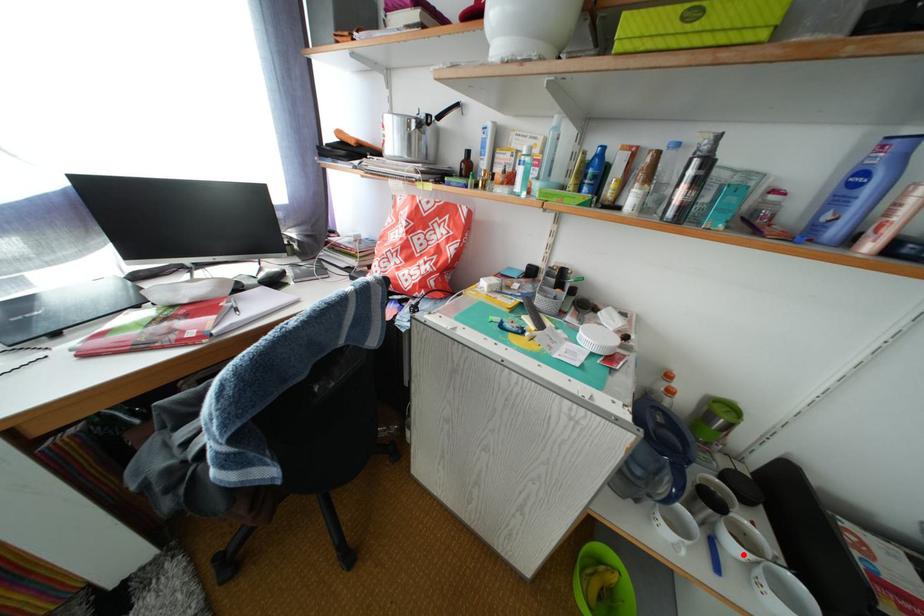
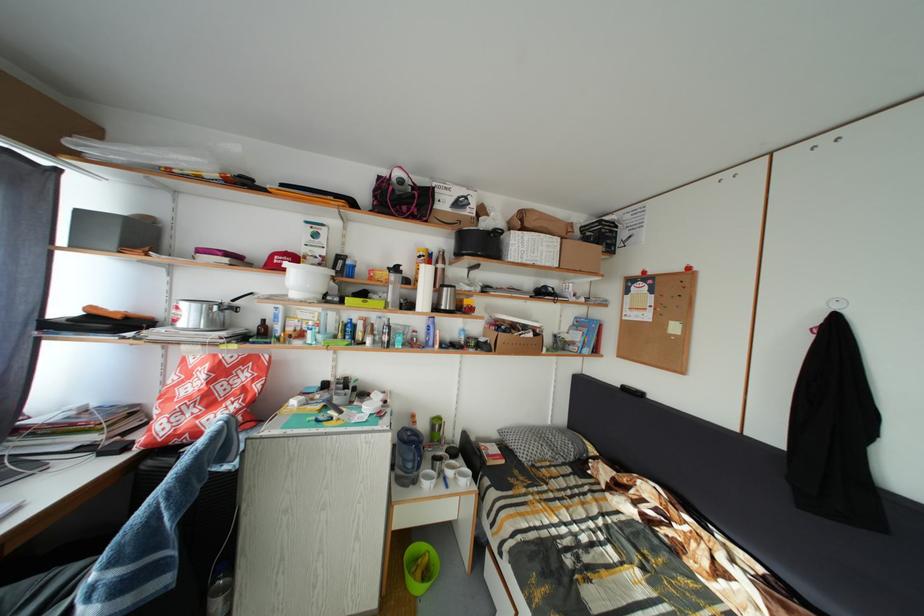
Question: I am providing you with two images of the same scene from different viewpoints. A red point is marked on the first image. Can you still see the location of the red point in image 2?

Choices:
 (A) Yes
 (B) No

Answer: (A)